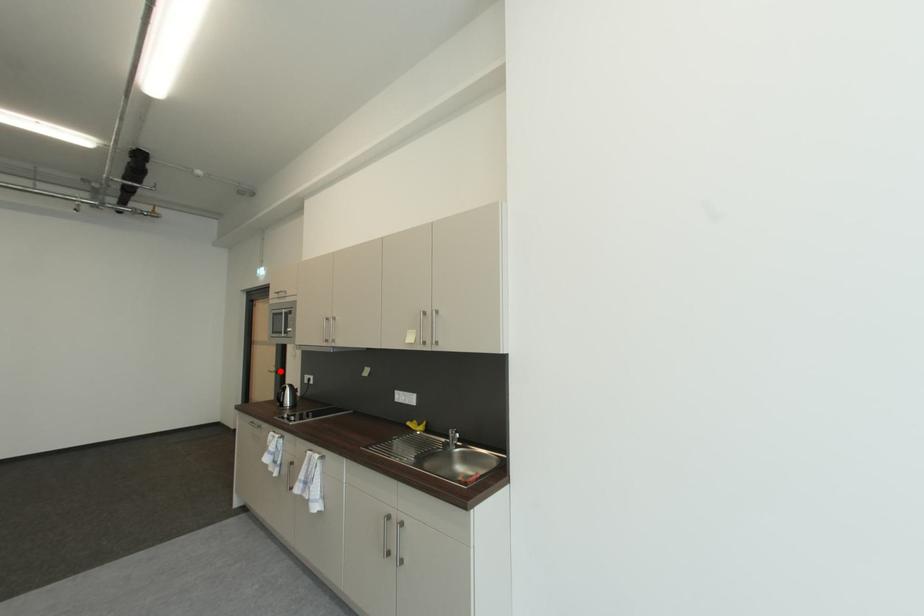
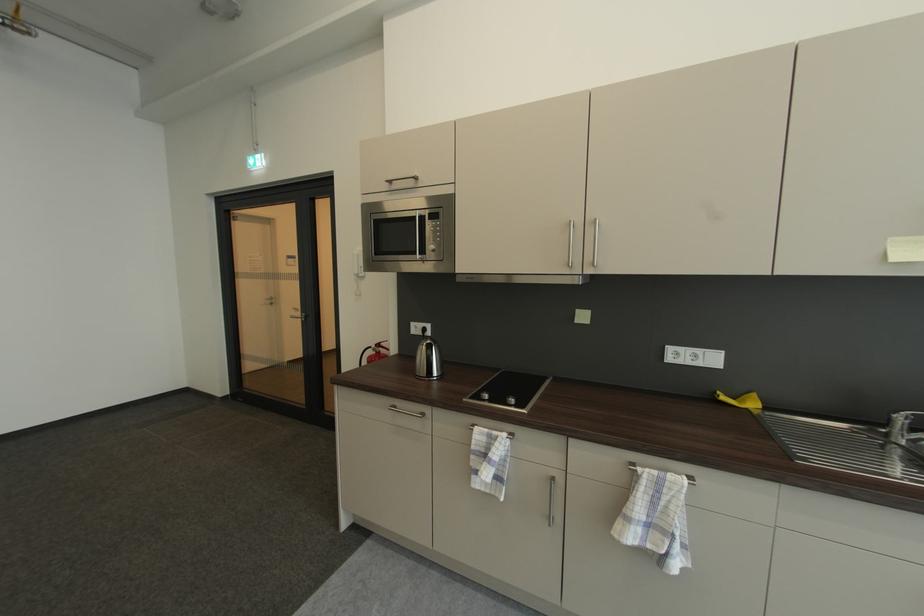
Question: I am providing you with two images of the same scene from different viewpoints. Image1 has a red point marked. In image2, the corresponding 3D location appears at what relative position? Reply with the corresponding letter.

Choices:
 (A) Closer
 (B) Farther

Answer: (A)